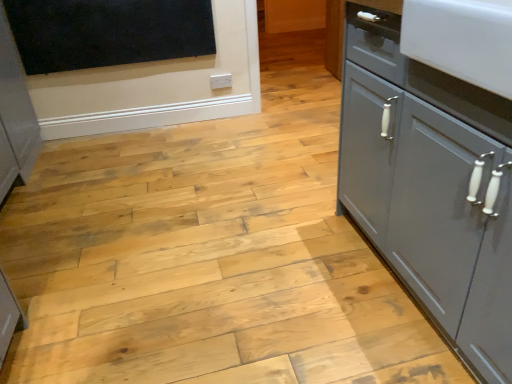
Question: Which is correct: black matte board at upper left is inside matte gray cabinet at right, or outside of it?

Choices:
 (A) inside
 (B) outside

Answer: (B)

Question: Considering the positions of black matte board at upper left and matte gray cabinet at right in the image, is black matte board at upper left wider or thinner than matte gray cabinet at right?

Choices:
 (A) wide
 (B) thin

Answer: (B)

Question: From a real-world perspective, is black matte board at upper left physically located above or below matte gray cabinet at right?

Choices:
 (A) above
 (B) below

Answer: (A)

Question: Does point (457, 261) appear closer or farther from the camera than point (160, 13)?

Choices:
 (A) farther
 (B) closer

Answer: (B)

Question: Is matte gray cabinet at right wider or thinner than black matte board at upper left?

Choices:
 (A) thin
 (B) wide

Answer: (B)

Question: Is matte gray cabinet at right to the left or to the right of black matte board at upper left in the image?

Choices:
 (A) right
 (B) left

Answer: (A)

Question: Is matte gray cabinet at right inside or outside of black matte board at upper left?

Choices:
 (A) inside
 (B) outside

Answer: (B)